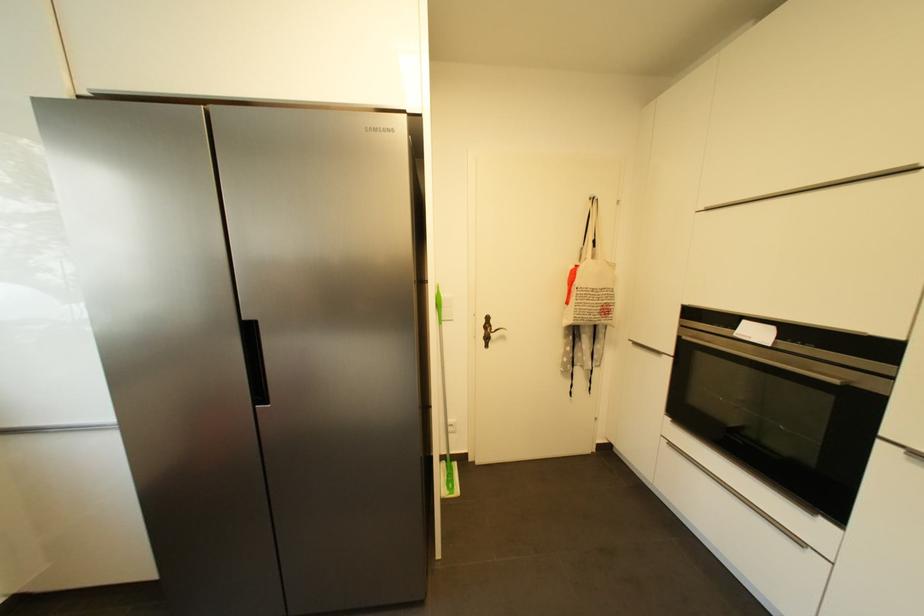
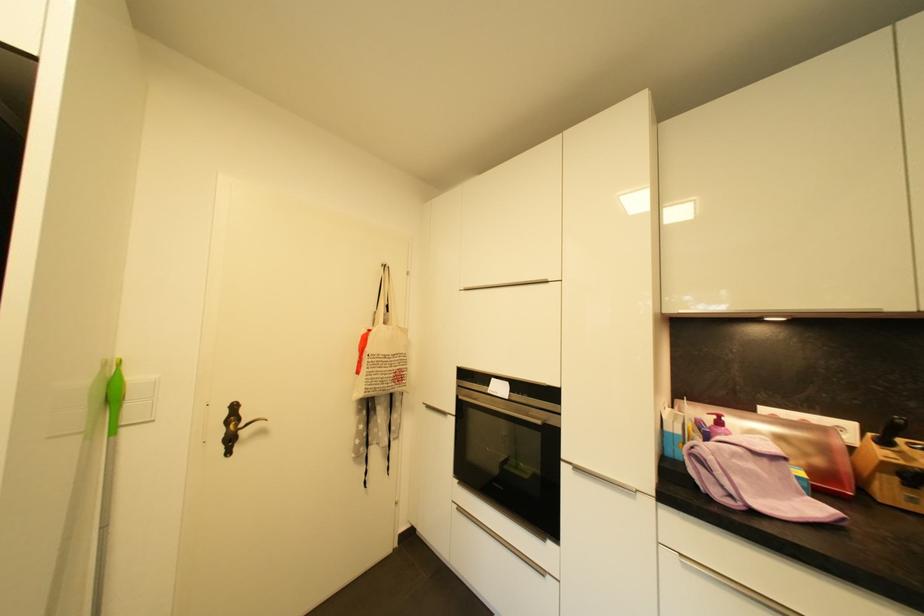
Find the pixel in the second image that matches pixel 689 339 in the first image.

(466, 399)